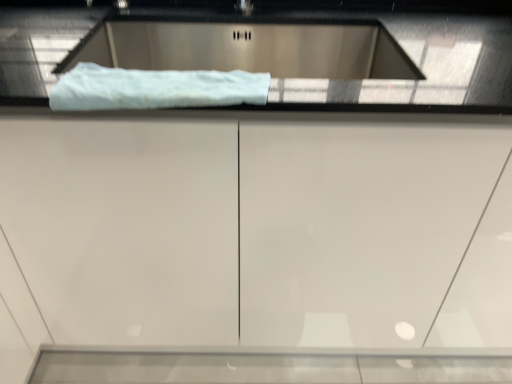
Question: Can you confirm if white fluffy towel at upper center is wider than white glossy cabinet at center?

Choices:
 (A) no
 (B) yes

Answer: (A)

Question: Is white fluffy towel at upper center positioned with its back to white glossy cabinet at center?

Choices:
 (A) yes
 (B) no

Answer: (A)

Question: Is white fluffy towel at upper center positioned behind white glossy cabinet at center?

Choices:
 (A) no
 (B) yes

Answer: (A)

Question: Is white fluffy towel at upper center at the left side of white glossy cabinet at center?

Choices:
 (A) no
 (B) yes

Answer: (B)

Question: Is white fluffy towel at upper center closer to the viewer compared to white glossy cabinet at center?

Choices:
 (A) yes
 (B) no

Answer: (A)

Question: In terms of size, does white glossy cabinet at center appear bigger or smaller than satin silver sink at upper center?

Choices:
 (A) big
 (B) small

Answer: (A)

Question: Is white glossy cabinet at center wider or thinner than satin silver sink at upper center?

Choices:
 (A) wide
 (B) thin

Answer: (A)

Question: From the image's perspective, is white glossy cabinet at center above or below satin silver sink at upper center?

Choices:
 (A) above
 (B) below

Answer: (B)

Question: Considering the positions of white glossy cabinet at center and satin silver sink at upper center in the image, is white glossy cabinet at center taller or shorter than satin silver sink at upper center?

Choices:
 (A) tall
 (B) short

Answer: (A)

Question: Is white glossy cabinet at center situated inside white fluffy towel at upper center or outside?

Choices:
 (A) outside
 (B) inside

Answer: (A)

Question: Is point (367, 329) positioned closer to the camera than point (236, 76)?

Choices:
 (A) closer
 (B) farther

Answer: (B)

Question: Is white glossy cabinet at center in front of or behind white fluffy towel at upper center in the image?

Choices:
 (A) front
 (B) behind

Answer: (B)

Question: From a real-world perspective, is white glossy cabinet at center positioned above or below white fluffy towel at upper center?

Choices:
 (A) above
 (B) below

Answer: (B)

Question: From the image's perspective, is white fluffy towel at upper center positioned above or below satin silver sink at upper center?

Choices:
 (A) below
 (B) above

Answer: (A)

Question: Based on their positions, is white fluffy towel at upper center located to the left or right of satin silver sink at upper center?

Choices:
 (A) right
 (B) left

Answer: (B)